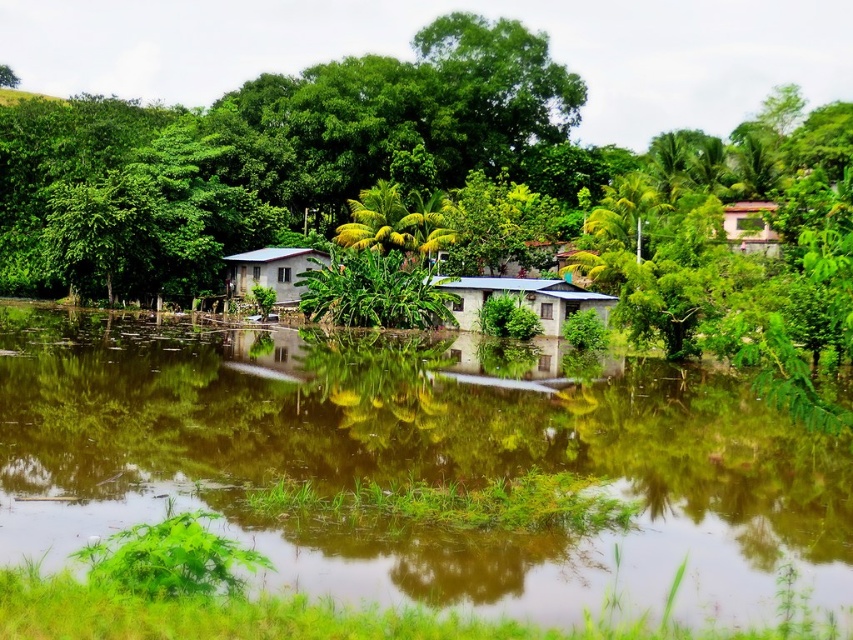
Question: Which point is farther to the camera?

Choices:
 (A) (686, 564)
 (B) (233, 253)
 (C) (730, 241)

Answer: (B)

Question: Estimate the real-world distances between objects in this image. Which object is farther from the pink matte hut at upper right?

Choices:
 (A) white corrugated metal hut at center
 (B) matte blue hut at center

Answer: (A)

Question: Which object is the closest to the pink matte hut at upper right?

Choices:
 (A) matte blue hut at center
 (B) brown reflective water at center

Answer: (A)

Question: Is brown reflective water at center to the right of matte blue hut at center from the viewer's perspective?

Choices:
 (A) no
 (B) yes

Answer: (A)

Question: Does brown reflective water at center appear on the left side of white corrugated metal hut at center?

Choices:
 (A) yes
 (B) no

Answer: (B)

Question: Can you confirm if matte blue hut at center is positioned below white corrugated metal hut at center?

Choices:
 (A) yes
 (B) no

Answer: (A)